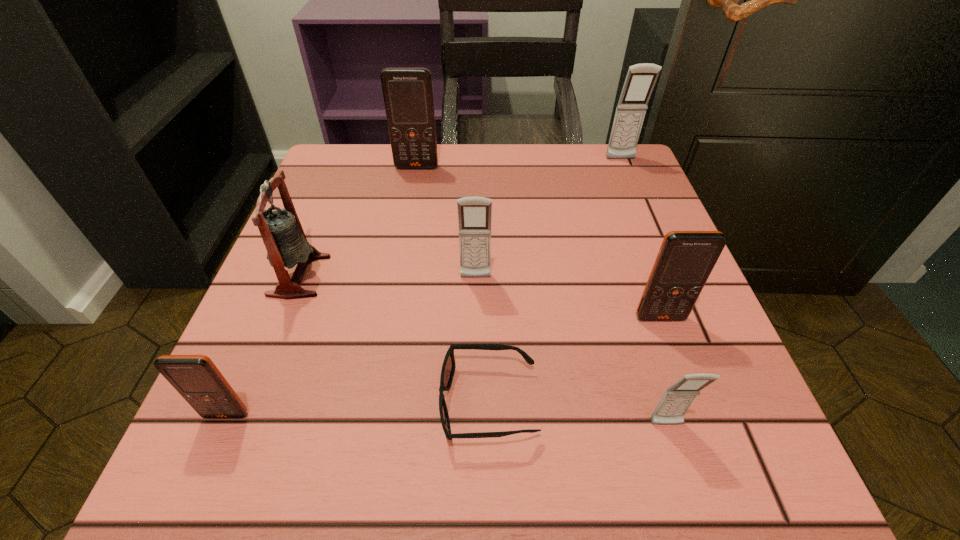
Select which gray cellular telephone appears as the third closest to the second orange cellular telephone from right to left. Please provide its 2D coordinates. Your answer should be formatted as a tuple, i.e. [(x, y)], where the tuple contains the x and y coordinates of a point satisfying the conditions above.

[(677, 399)]

I want to click on the second closest gray cellular telephone to the sunglasses, so click(474, 213).

The height and width of the screenshot is (540, 960). In order to click on orange cellular telephone object that ranks as the closest to the bell in this screenshot , I will do `click(196, 378)`.

The height and width of the screenshot is (540, 960). Identify the location of the third closest orange cellular telephone to the smallest gray cellular telephone. pos(408,93).

Where is `vacant space that satisfies the following two spatial constraints: 1. on the front-facing side of the sunglasses; 2. on the screen of the smallest orange cellular telephone`? The height and width of the screenshot is (540, 960). vacant space that satisfies the following two spatial constraints: 1. on the front-facing side of the sunglasses; 2. on the screen of the smallest orange cellular telephone is located at coordinates (489, 415).

Identify the location of vacant point that satisfies the following two spatial constraints: 1. on the front-facing side of the shortest object; 2. on the screen of the leftmost cellular telephone. The width and height of the screenshot is (960, 540). (489, 415).

Locate an element on the screen. free spot that satisfies the following two spatial constraints: 1. on the front-facing side of the shortest object; 2. on the screen of the leftmost orange cellular telephone is located at coordinates (489, 415).